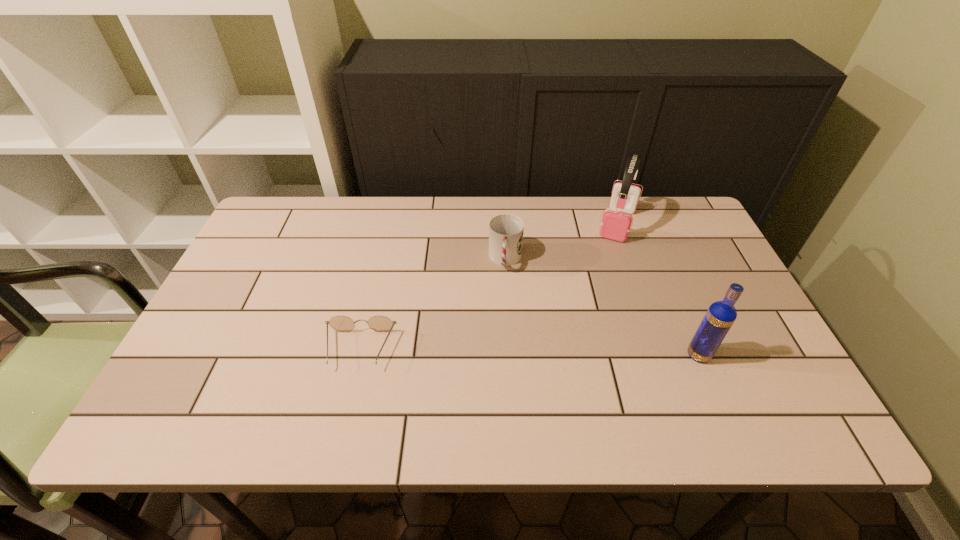
I want to click on spectacles, so click(378, 323).

Locate an element on the screen. The image size is (960, 540). the leftmost object is located at coordinates (378, 323).

Locate an element on the screen. The height and width of the screenshot is (540, 960). vodka is located at coordinates (720, 316).

Locate an element on the screen. The image size is (960, 540). cup is located at coordinates (506, 231).

Identify the location of the third object from right to left. (506, 231).

At what (x,y) coordinates should I click in order to perform the action: click on earphone. Please return your answer as a coordinate pair (x, y). Looking at the image, I should click on (616, 222).

Find the location of a particular element. blank space located 0.120m on the right of the vodka is located at coordinates (762, 355).

Find the location of a particular element. free space located on the handle side of the cup is located at coordinates (498, 345).

You are a GUI agent. You are given a task and a screenshot of the screen. Output one action in this format:
    pyautogui.click(x=<x>, y=<y>)
    Task: Click on the free space located on the handle side of the cup
    
    Given the screenshot: What is the action you would take?
    pyautogui.click(x=501, y=309)

Identify the location of free space located 0.210m on the handle side of the cup. This screenshot has height=540, width=960. (498, 338).